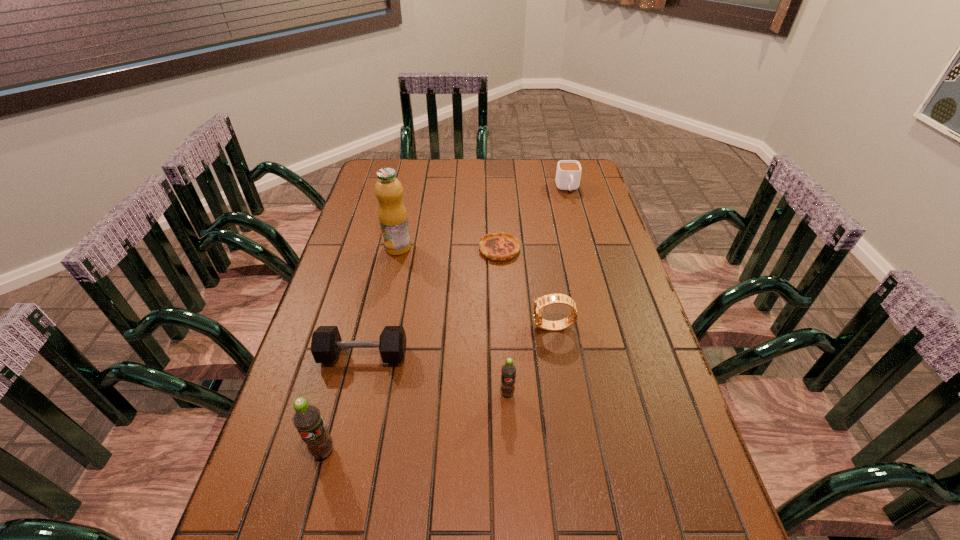
Image resolution: width=960 pixels, height=540 pixels. I want to click on object at the far edge, so click(x=568, y=174).

Locate an element on the screen. The image size is (960, 540). soda present at the left edge is located at coordinates (307, 419).

I want to click on fruit juice at the left edge, so click(392, 214).

At what (x,y) coordinates should I click in order to perform the action: click on dumbbell located at the left edge. Please return your answer as a coordinate pair (x, y). This screenshot has height=540, width=960. Looking at the image, I should click on (326, 343).

Locate an element on the screen. The height and width of the screenshot is (540, 960). object at the right edge is located at coordinates tap(568, 174).

The height and width of the screenshot is (540, 960). I want to click on object located at the far right corner, so click(568, 174).

Identify the location of blank area at the far edge. (516, 186).

Where is `free space at the near edge of the desktop`? free space at the near edge of the desktop is located at coordinates (420, 505).

I want to click on vacant space at the left edge, so click(311, 374).

You are a GUI agent. You are given a task and a screenshot of the screen. Output one action in this format:
    pyautogui.click(x=<x>, y=<y>)
    Task: Click on the vacant space at the right edge of the desktop
    This screenshot has width=960, height=540.
    Given the screenshot: What is the action you would take?
    pyautogui.click(x=672, y=403)